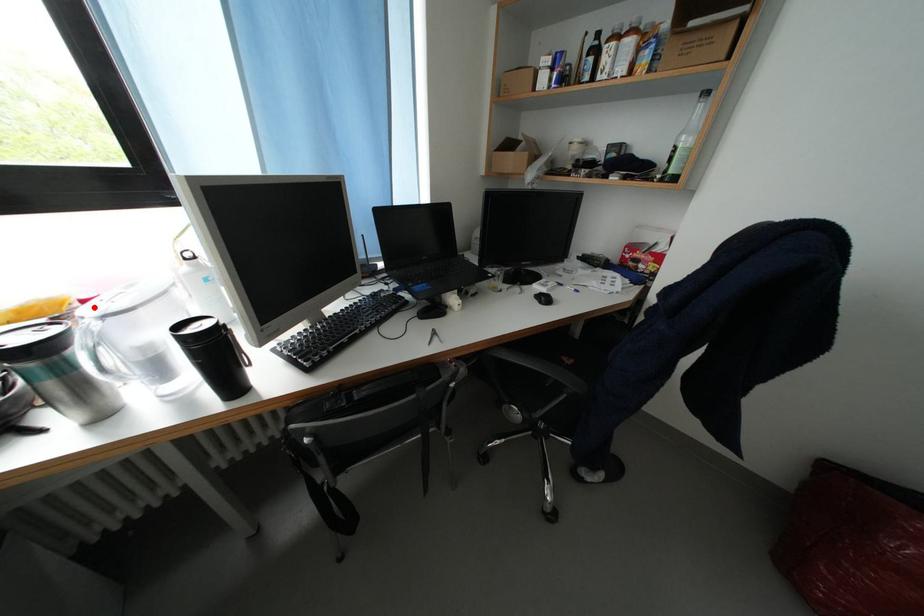
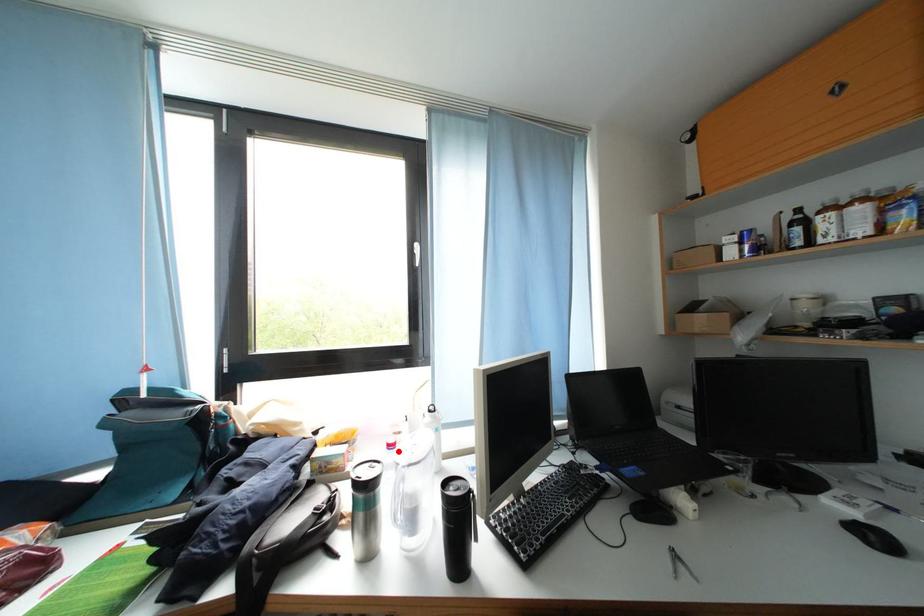
I am providing you with two images of the same scene from different viewpoints. A red point is marked on the first image and another point is marked on the second image. Do the highlighted points in image1 and image2 indicate the same real-world spot?

Yes